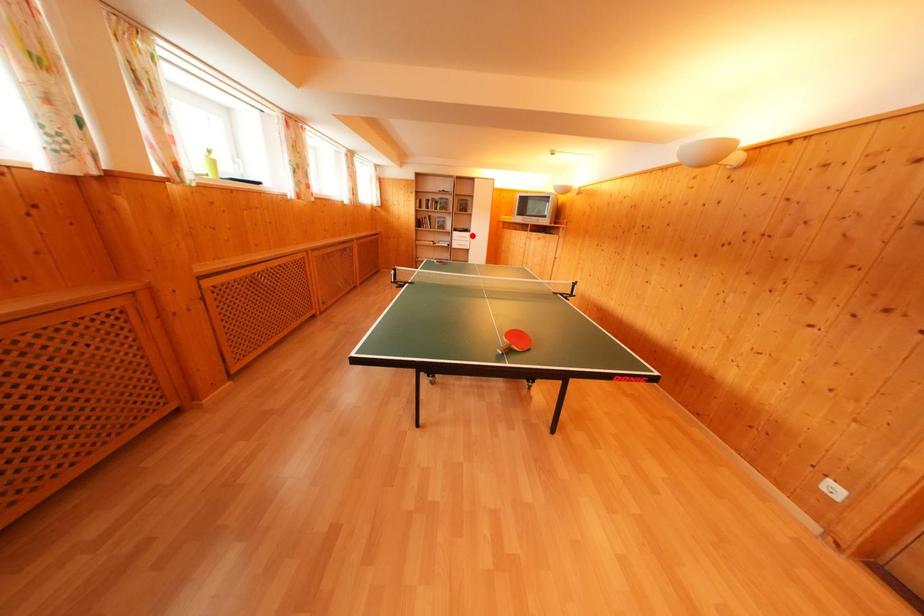
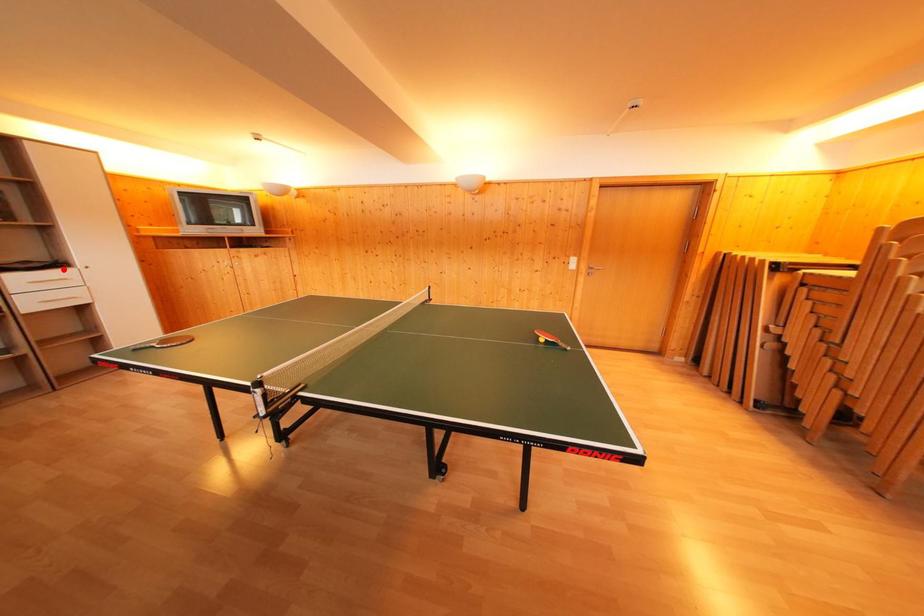
I am providing you with two images of the same scene from different viewpoints. A red point is marked on the first image and another point is marked on the second image. Do the highlighted points in image1 and image2 indicate the same real-world spot?

Yes